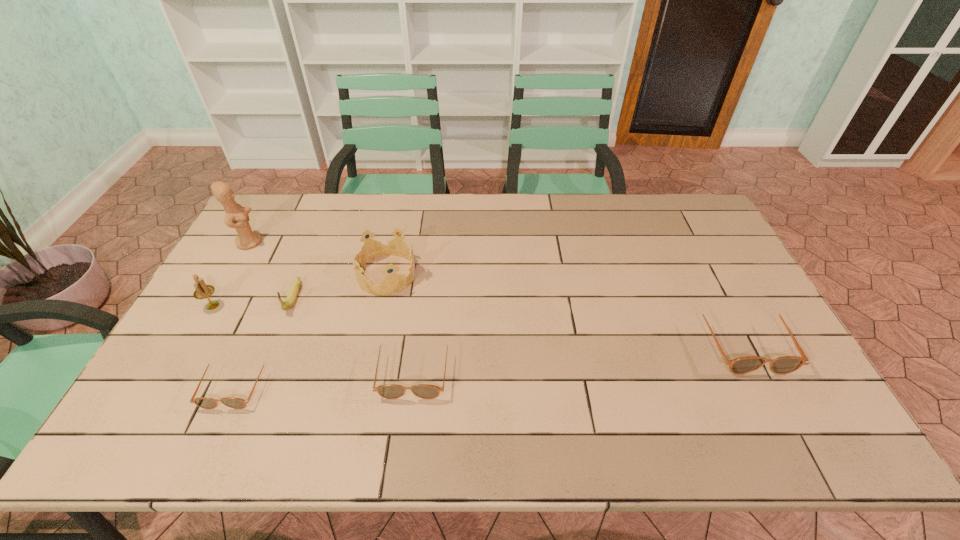
In order to click on the shortest object in this screenshot , I will do `click(203, 402)`.

This screenshot has height=540, width=960. What are the coordinates of `the leftmost sunglasses` in the screenshot? It's located at (203, 402).

I want to click on the sixth tallest object, so click(x=389, y=391).

Find the location of a particular element. The height and width of the screenshot is (540, 960). the second shortest sunglasses is located at coordinates (389, 391).

Where is `the third shortest object`? the third shortest object is located at coordinates (787, 364).

Locate an element on the screen. This screenshot has width=960, height=540. the rightmost object is located at coordinates [787, 364].

Where is `tiara`? The image size is (960, 540). tiara is located at coordinates (393, 283).

The image size is (960, 540). Identify the location of the farthest object. (237, 217).

Where is `the tallest object`? Image resolution: width=960 pixels, height=540 pixels. the tallest object is located at coordinates (237, 217).

The height and width of the screenshot is (540, 960). I want to click on banana, so click(292, 295).